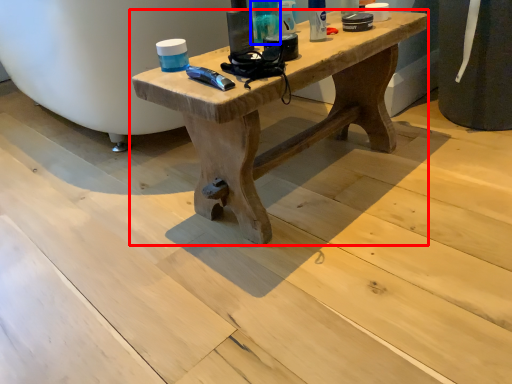
Question: Which object is further to the camera taking this photo, table (highlighted by a red box) or toiletry (highlighted by a blue box)?

Choices:
 (A) table
 (B) toiletry

Answer: (B)